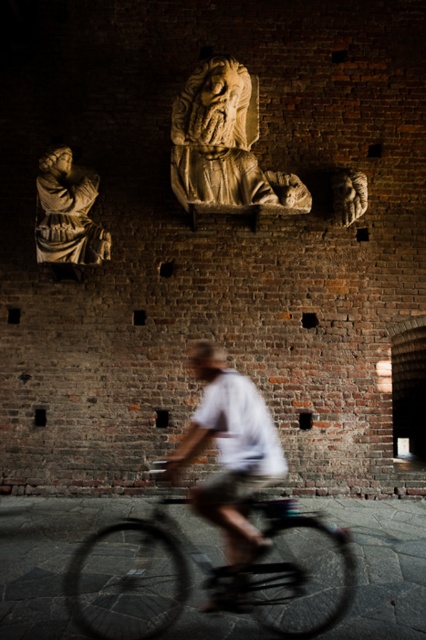
Is metallic bicycle at center bigger than white matte shirt at center?

Correct, metallic bicycle at center is larger in size than white matte shirt at center.

Does point (281, 636) come closer to viewer compared to point (229, 484)?

Yes.

What are the coordinates of `metallic bicycle at center` in the screenshot? It's located at (210, 573).

Does white matte shirt at center appear under beige stone sculpture at upper center?

Yes.

Is point (267, 429) positioned in front of point (207, 106)?

That is True.

Identify the location of white matte shirt at center. Image resolution: width=426 pixels, height=640 pixels. tap(229, 451).

Is beige stone sculpture at upper center bigger than matte stone statue at upper center?

Yes, beige stone sculpture at upper center is bigger than matte stone statue at upper center.

Can you confirm if beige stone sculpture at upper center is wider than matte stone statue at upper center?

Indeed, beige stone sculpture at upper center has a greater width compared to matte stone statue at upper center.

This screenshot has width=426, height=640. I want to click on beige stone sculpture at upper center, so click(x=224, y=145).